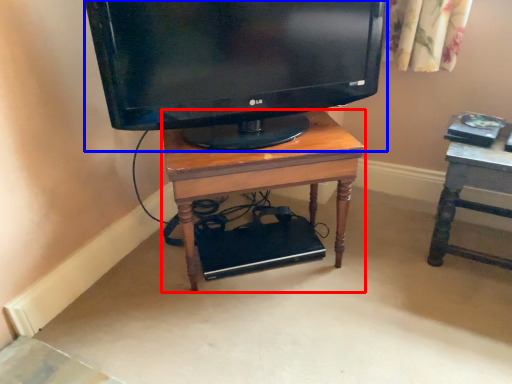
Question: Which of the following is the farthest to the observer, desk (highlighted by a red box) or television (highlighted by a blue box)?

Choices:
 (A) desk
 (B) television

Answer: (A)